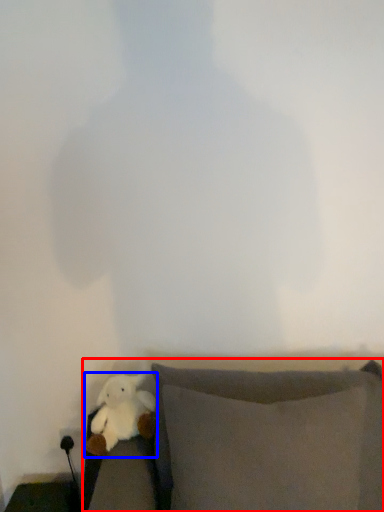
Question: Which object appears farthest to the camera in this image, furniture (highlighted by a red box) or toy (highlighted by a blue box)?

Choices:
 (A) furniture
 (B) toy

Answer: (B)